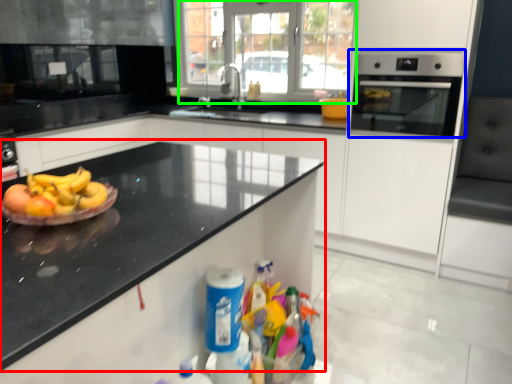
Question: Estimate the real-world distances between objects in this image. Which object is farther from countertop (highlighted by a red box), home appliance (highlighted by a blue box) or glass door (highlighted by a green box)?

Choices:
 (A) home appliance
 (B) glass door

Answer: (B)